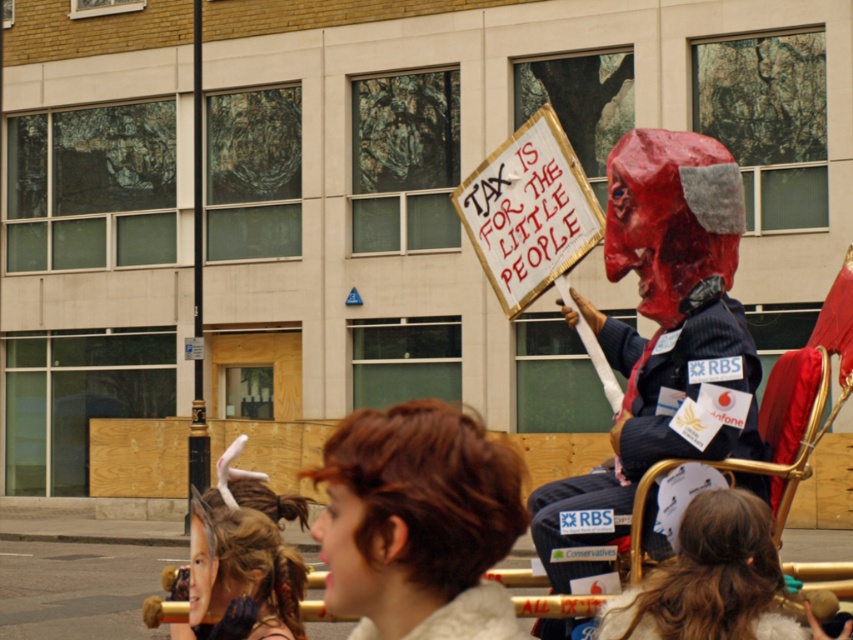
Is brown hair at center smaller than shiny gold hair at lower left?

No, brown hair at center is not smaller than shiny gold hair at lower left.

Which is more to the right, brown hair at center or shiny gold hair at lower left?

Positioned to the right is shiny gold hair at lower left.

What do you see at coordinates (416, 522) in the screenshot? I see `brown hair at center` at bounding box center [416, 522].

The height and width of the screenshot is (640, 853). I want to click on brown hair at center, so click(x=416, y=522).

Between brown fur coat at center and shiny gold hair at lower left, which one is positioned lower?

shiny gold hair at lower left

Who is more distant from viewer, (x=645, y=593) or (x=206, y=548)?

Point (x=206, y=548)

Describe the element at coordinates (711, 579) in the screenshot. This screenshot has height=640, width=853. I see `brown fur coat at center` at that location.

This screenshot has height=640, width=853. What are the coordinates of `brown fur coat at center` in the screenshot? It's located at (711, 579).

Between matte red mask at center and brown fur coat at center, which one appears on the left side from the viewer's perspective?

From the viewer's perspective, brown fur coat at center appears more on the left side.

Does matte red mask at center come in front of brown fur coat at center?

No, matte red mask at center is further to the viewer.

Is point (598, 483) positioned after point (686, 620)?

Yes.

This screenshot has height=640, width=853. Identify the location of matte red mask at center. (660, 323).